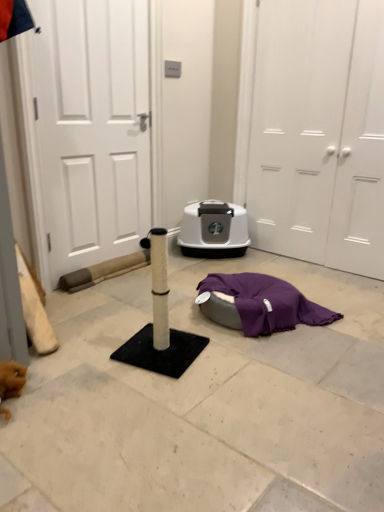
Image resolution: width=384 pixels, height=512 pixels. What do you see at coordinates (92, 128) in the screenshot?
I see `white matte door at left, the 3th door from the right` at bounding box center [92, 128].

The height and width of the screenshot is (512, 384). In order to click on purple fabric at lower center in this screenshot , I will do `click(258, 304)`.

Locate an element on the screen. white matte door at right, the first door from the right is located at coordinates (361, 155).

Where is `white matte door at center, the 2th door from the right`? white matte door at center, the 2th door from the right is located at coordinates (319, 133).

Considering the sizes of objects white matte door at center, the 2th door from the right, and white matte door at left, acting as the first door starting from the left, in the image provided, who is bigger, white matte door at center, the 2th door from the right, or white matte door at left, acting as the first door starting from the left,?

With larger size is white matte door at center, the 2th door from the right.

Can we say white matte door at center, which appears as the second door when viewed from the left, lies outside white matte door at left, the 3th door from the right?

Yes, white matte door at center, which appears as the second door when viewed from the left, is not within white matte door at left, the 3th door from the right.

How many degrees apart are the facing directions of white matte door at center, which appears as the second door when viewed from the left, and white matte door at left, acting as the first door starting from the left?

The angle between the facing direction of white matte door at center, which appears as the second door when viewed from the left, and the facing direction of white matte door at left, acting as the first door starting from the left, is 88.9 degrees.

Considering the positions of point (306, 73) and point (63, 25), is point (306, 73) closer or farther from the camera than point (63, 25)?

Point (306, 73) appears to be farther away from the viewer than point (63, 25).

Is white matte door at center, the 2th door from the right, at the right side of white textured scratching post at center?

Indeed, white matte door at center, the 2th door from the right, is positioned on the right side of white textured scratching post at center.

From the image's perspective, between white matte door at center, the 2th door from the right, and white textured scratching post at center, which one is located above?

white matte door at center, the 2th door from the right, appears higher in the image.

Are white matte door at center, which appears as the second door when viewed from the left, and white textured scratching post at center located far from each other?

Absolutely, white matte door at center, which appears as the second door when viewed from the left, is distant from white textured scratching post at center.

Could you tell me if white matte door at center, which appears as the second door when viewed from the left, is facing white textured scratching post at center?

Yes, white matte door at center, which appears as the second door when viewed from the left, is turned towards white textured scratching post at center.

Between white matte door at left, the 3th door from the right, and white textured scratching post at center, which one appears on the left side from the viewer's perspective?

white matte door at left, the 3th door from the right, is more to the left.

Does white matte door at left, acting as the first door starting from the left, have a greater height compared to white textured scratching post at center?

Yes, white matte door at left, acting as the first door starting from the left, is taller than white textured scratching post at center.

From the image's perspective, is white matte door at left, acting as the first door starting from the left, located above or below white textured scratching post at center?

From the image's perspective, white matte door at left, acting as the first door starting from the left, appears above white textured scratching post at center.

Is white matte door at left, acting as the first door starting from the left, bigger than white textured scratching post at center?

No, white matte door at left, acting as the first door starting from the left, is not bigger than white textured scratching post at center.

Is point (226, 298) closer or farther from the camera than point (349, 129)?

Clearly, point (226, 298) is closer to the camera than point (349, 129).

Considering the sizes of objects purple fabric at lower center and white matte door at center, which appears as the second door when viewed from the left, in the image provided, who is taller, purple fabric at lower center or white matte door at center, which appears as the second door when viewed from the left,?

Standing taller between the two is white matte door at center, which appears as the second door when viewed from the left.

Based on the photo, what's the angular difference between purple fabric at lower center and white matte door at center, which appears as the second door when viewed from the left,'s facing directions?

They differ by 22.1 degrees in their facing directions.

Do you think purple fabric at lower center is within white matte door at center, the 2th door from the right, or outside of it?

purple fabric at lower center is spatially situated outside white matte door at center, the 2th door from the right.

Which of these two, white textured scratching post at center or white matte door at right, which appears as the 3th door when viewed from the left, is smaller?

white matte door at right, which appears as the 3th door when viewed from the left.

Is white matte door at right, the first door from the right, a part of white textured scratching post at center?

That's incorrect, white matte door at right, the first door from the right, is not inside white textured scratching post at center.

Is white textured scratching post at center behind white matte door at right, which appears as the 3th door when viewed from the left?

No, white textured scratching post at center is in front of white matte door at right, which appears as the 3th door when viewed from the left.

In the image, is white textured scratching post at center on the left side or the right side of white matte door at right, the first door from the right?

In the image, white textured scratching post at center appears on the left side of white matte door at right, the first door from the right.

Is white matte door at right, which appears as the 3th door when viewed from the left, positioned beyond the bounds of white matte door at left, the 3th door from the right?

white matte door at right, which appears as the 3th door when viewed from the left, is positioned outside white matte door at left, the 3th door from the right.

Is white matte door at right, which appears as the 3th door when viewed from the left, positioned behind white matte door at left, the 3th door from the right?

Yes, white matte door at right, which appears as the 3th door when viewed from the left, is further from the camera.

In the scene shown: Considering the positions of objects white matte door at right, the first door from the right, and white matte door at left, acting as the first door starting from the left, in the image provided, who is more to the right, white matte door at right, the first door from the right, or white matte door at left, acting as the first door starting from the left,?

Positioned to the right is white matte door at right, the first door from the right.

Considering the sizes of objects white matte door at right, which appears as the 3th door when viewed from the left, and white matte door at left, acting as the first door starting from the left, in the image provided, who is wider, white matte door at right, which appears as the 3th door when viewed from the left, or white matte door at left, acting as the first door starting from the left,?

With larger width is white matte door at left, acting as the first door starting from the left.

Is point (340, 199) closer to camera compared to point (128, 423)?

No, it is not.

From the picture: Considering the sizes of objects white matte door at right, which appears as the 3th door when viewed from the left, and white textured scratching post at center in the image provided, who is bigger, white matte door at right, which appears as the 3th door when viewed from the left, or white textured scratching post at center?

Bigger between the two is white textured scratching post at center.

Based on the photo, is white matte door at right, which appears as the 3th door when viewed from the left, far away from white textured scratching post at center?

That's right, there is a large distance between white matte door at right, which appears as the 3th door when viewed from the left, and white textured scratching post at center.

Which of these two, white matte door at right, the first door from the right, or white textured scratching post at center, stands taller?

With more height is white matte door at right, the first door from the right.

From the image's perspective, which door is the 1st one below the white matte door at center, the 2th door from the right? Please provide its 2D coordinates.

[(92, 128)]

Find the location of a particular element. The image size is (384, 512). concrete below the white matte door at center, which appears as the second door when viewed from the left (from a real-world perspective) is located at coordinates (203, 404).

Considering their positions, is white matte door at left, acting as the first door starting from the left, positioned closer to purple fabric at lower center than white textured scratching post at center?

The object closer to purple fabric at lower center is white textured scratching post at center.

Considering their positions, is purple fabric at lower center positioned further to white matte door at right, the first door from the right, than white matte door at center, which appears as the second door when viewed from the left?

Based on the image, purple fabric at lower center appears to be further to white matte door at right, the first door from the right.

Based on their spatial positions, is white matte door at left, acting as the first door starting from the left, or white matte door at center, the 2th door from the right, closer to purple fabric at lower center?

white matte door at center, the 2th door from the right.

Based on their spatial positions, is white textured scratching post at center or white matte door at left, acting as the first door starting from the left, further from white matte door at right, which appears as the 3th door when viewed from the left?

Among the two, white matte door at left, acting as the first door starting from the left, is located further to white matte door at right, which appears as the 3th door when viewed from the left.

When comparing their distances from white matte door at left, acting as the first door starting from the left, does white matte door at center, the 2th door from the right, or purple fabric at lower center seem closer?

Among the two, purple fabric at lower center is located nearer to white matte door at left, acting as the first door starting from the left.

Based on their spatial positions, is white matte door at center, which appears as the second door when viewed from the left, or white matte door at left, the 3th door from the right, further from white textured scratching post at center?

white matte door at center, which appears as the second door when viewed from the left, is further to white textured scratching post at center.

Which object lies further to the anchor point purple fabric at lower center, white matte door at right, the first door from the right, or white matte door at center, which appears as the second door when viewed from the left?

The object further to purple fabric at lower center is white matte door at center, which appears as the second door when viewed from the left.

Estimate the real-world distances between objects in this image. Which object is further from white matte door at right, the first door from the right, purple fabric at lower center or white matte door at left, acting as the first door starting from the left?

white matte door at left, acting as the first door starting from the left, is positioned further to the anchor white matte door at right, the first door from the right.

The height and width of the screenshot is (512, 384). Find the location of `blanket situated between white matte door at left, acting as the first door starting from the left, and white matte door at right, which appears as the 3th door when viewed from the left, from left to right`. blanket situated between white matte door at left, acting as the first door starting from the left, and white matte door at right, which appears as the 3th door when viewed from the left, from left to right is located at coordinates (258, 304).

Identify the location of blanket positioned between white textured scratching post at center and white matte door at center, which appears as the second door when viewed from the left, from near to far. This screenshot has width=384, height=512. (258, 304).

At what (x,y) coordinates should I click in order to perform the action: click on blanket located between white matte door at left, the 3th door from the right, and white matte door at center, the 2th door from the right, in the left-right direction. Please return your answer as a coordinate pair (x, y). The image size is (384, 512). Looking at the image, I should click on (258, 304).

Locate an element on the screen. door between white matte door at left, acting as the first door starting from the left, and white matte door at right, which appears as the 3th door when viewed from the left, from left to right is located at coordinates (319, 133).